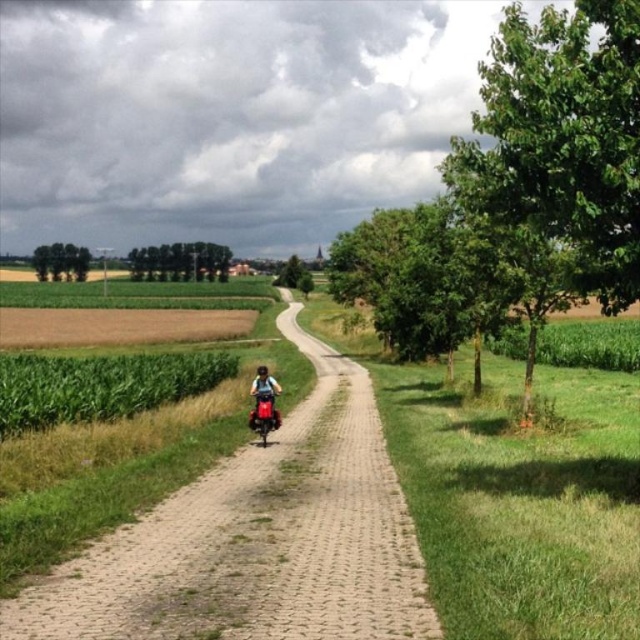
Question: Which point is farther to the camera?

Choices:
 (A) green leafy trees at center
 (B) green leafy trees at left

Answer: (B)

Question: Estimate the real-world distances between objects in this image. Which object is closer to the green leafy tree at center?

Choices:
 (A) green leafy trees at left
 (B) green leafy trees at center

Answer: (B)

Question: Is green matte corn field at left thinner than green leafy trees at center?

Choices:
 (A) yes
 (B) no

Answer: (A)

Question: Does paved brick path at center have a lesser width compared to green leafy trees at left?

Choices:
 (A) yes
 (B) no

Answer: (A)

Question: Which point is farther to the camera?

Choices:
 (A) (269, 397)
 (B) (157, 353)
 (C) (259, 365)
 (D) (44, 246)

Answer: (D)

Question: Observing the image, what is the correct spatial positioning of green matte corn field at left in reference to green leafy tree at center?

Choices:
 (A) left
 (B) right

Answer: (B)